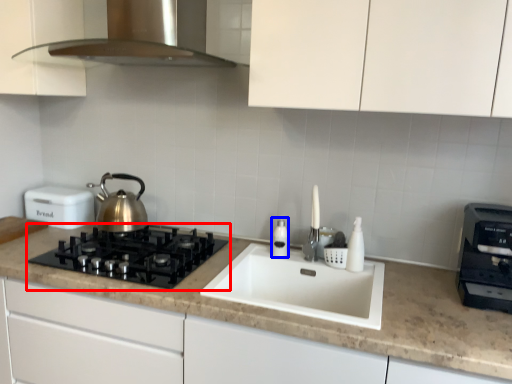
Question: Among these objects, which one is farthest to the camera, gas stove (highlighted by a red box) or bottle (highlighted by a blue box)?

Choices:
 (A) gas stove
 (B) bottle

Answer: (B)